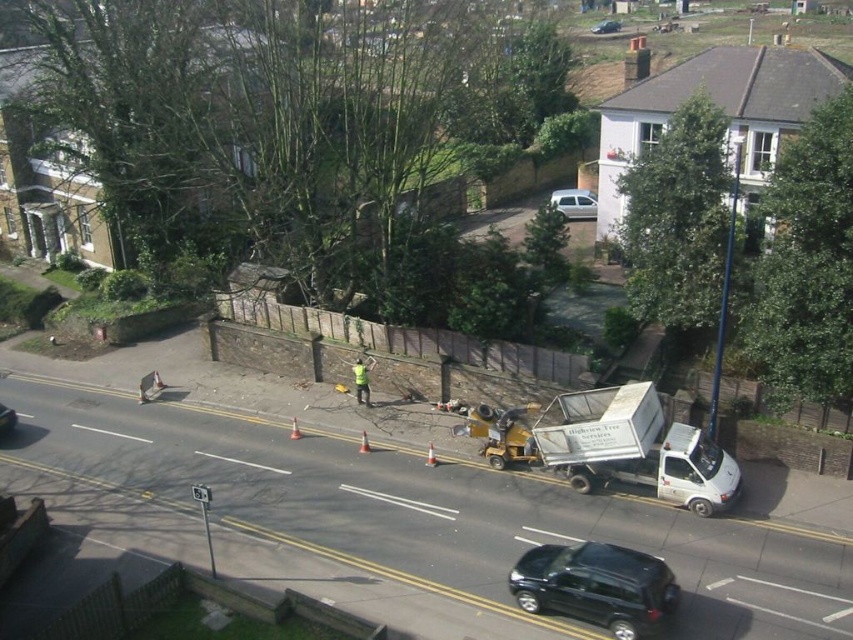
Question: Which of the following is the farthest from the observer?

Choices:
 (A) (595, 32)
 (B) (364, 396)
 (C) (4, 419)
 (D) (589, 465)

Answer: (A)

Question: Which is nearer to the black glossy car at left?

Choices:
 (A) silver metallic hatchback at center
 (B) yellow reflective vest at center
 (C) white matte truck at right
 (D) shiny black suv at lower center

Answer: (B)

Question: Observing the image, what is the correct spatial positioning of yellow reflective vest at center in reference to metallic silver car at center?

Choices:
 (A) below
 (B) above

Answer: (A)

Question: Is silver metallic hatchback at center above black glossy car at left?

Choices:
 (A) yes
 (B) no

Answer: (A)

Question: Based on their relative distances, which object is nearer to the black glossy car at left?

Choices:
 (A) metallic silver car at center
 (B) silver metallic hatchback at center
 (C) shiny black suv at lower center
 (D) white matte truck at right

Answer: (D)

Question: Does silver metallic hatchback at center have a smaller size compared to yellow reflective vest at center?

Choices:
 (A) yes
 (B) no

Answer: (B)